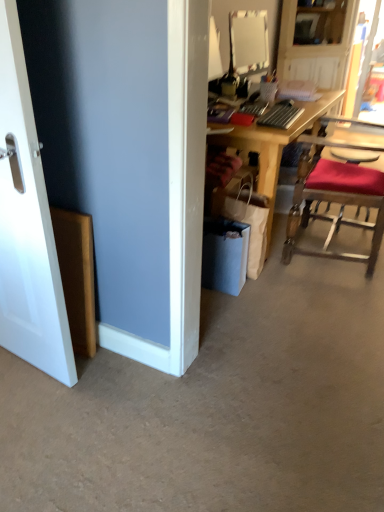
Question: Is wooden chair with red cushion at right to the left or to the right of wooden desk at center in the image?

Choices:
 (A) left
 (B) right

Answer: (B)

Question: In terms of width, does wooden chair with red cushion at right look wider or thinner when compared to wooden desk at center?

Choices:
 (A) thin
 (B) wide

Answer: (A)

Question: Which object is positioned closest to the white smooth door at left?

Choices:
 (A) wooden desk at center
 (B) gray carpet at lower center
 (C) wooden desk at upper right
 (D) wooden chair with red cushion at right

Answer: (B)

Question: Based on their relative distances, which object is nearer to the white smooth door at left?

Choices:
 (A) wooden desk at upper right
 (B) wooden chair with red cushion at right
 (C) wooden desk at center
 (D) gray carpet at lower center

Answer: (D)